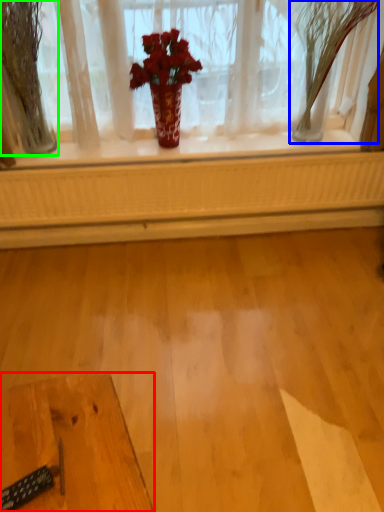
Question: Estimate the real-world distances between objects in this image. Which object is farther from table (highlighted by a red box), tree (highlighted by a blue box) or tree (highlighted by a green box)?

Choices:
 (A) tree
 (B) tree

Answer: (A)